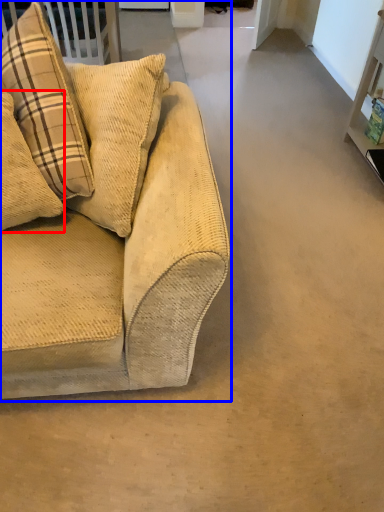
Question: Which of the following is the farthest to the observer, pillow (highlighted by a red box) or studio couch (highlighted by a blue box)?

Choices:
 (A) pillow
 (B) studio couch

Answer: (A)